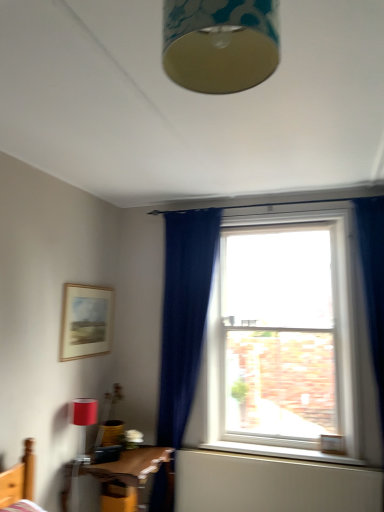
Where is `free point above wooden table at lower left (from a real-world perspective)`? free point above wooden table at lower left (from a real-world perspective) is located at coordinates (134, 454).